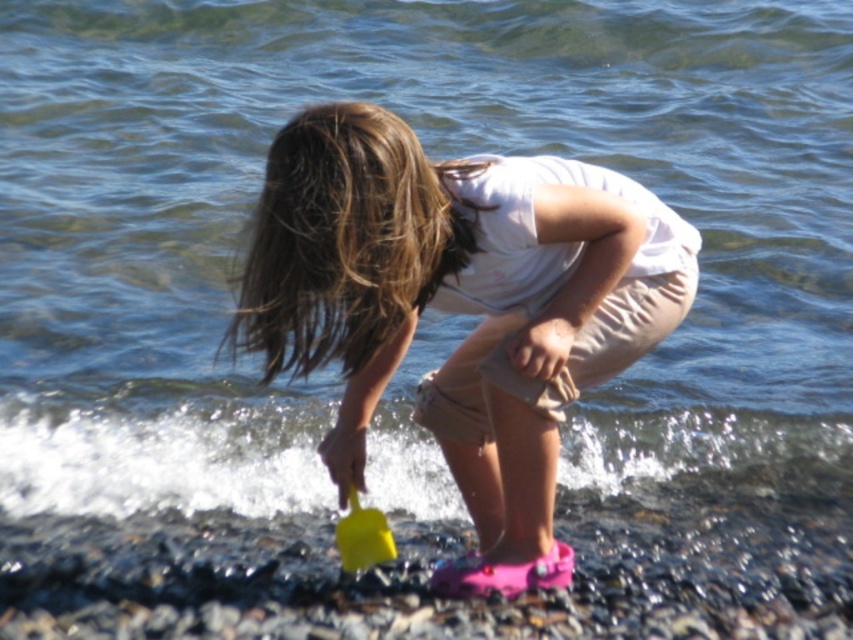
Question: Can you confirm if white cotton shirt at center is positioned below yellow plastic shovel at lower center?

Choices:
 (A) yes
 (B) no

Answer: (B)

Question: Does white cotton shirt at center appear on the left side of yellow plastic shovel at lower center?

Choices:
 (A) no
 (B) yes

Answer: (A)

Question: Which point is farther from the camera taking this photo?

Choices:
 (A) (386, 378)
 (B) (352, 525)

Answer: (A)

Question: Can you confirm if white cotton shirt at center is smaller than yellow plastic shovel at lower center?

Choices:
 (A) no
 (B) yes

Answer: (A)

Question: Which point is closer to the camera?

Choices:
 (A) yellow plastic shovel at lower center
 (B) white cotton shirt at center

Answer: (B)